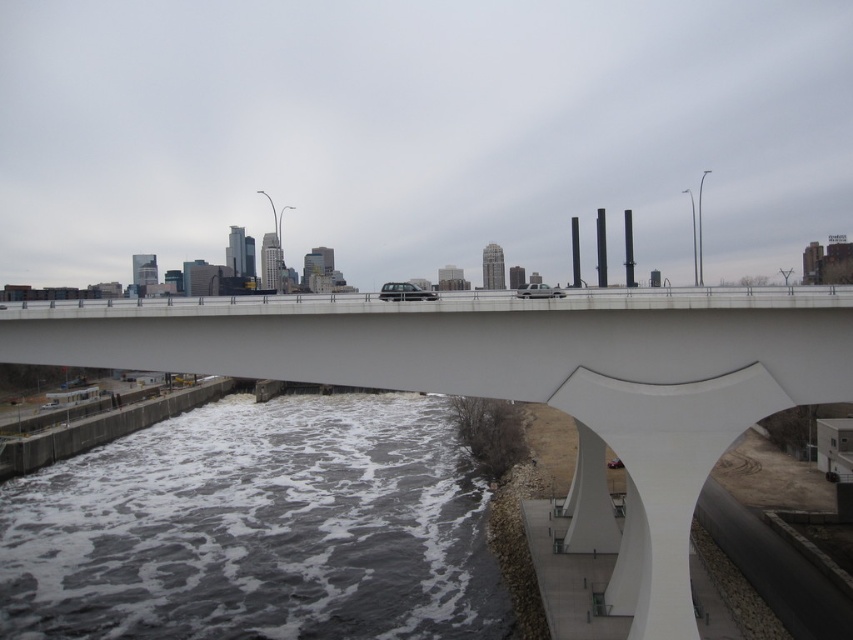
You are a photographer standing on the riverbank and want to capture both the white frothy water at lower center and the white smooth bridge at center in a single photo. Which object will appear closer to you in the photo?

The white frothy water at lower center will appear closer to you in the photo because it is further to the viewer than the white smooth bridge at center, making it appear nearer in the image.

You are a drone operator tasked with capturing aerial footage of the white smooth bridge at center. Your drone has a maximum flight altitude of 25 meters. If you position the drone directly above the white frothy water at lower center, will the drone be able to fly under the bridge without exceeding its altitude limit?

The distance between the white frothy water at lower center and the white smooth bridge at center is 24.53 meters. Since the drone can fly up to 25 meters, it will be able to safely fly under the bridge without exceeding its altitude limit.

You are a city planner analyzing the image to assess the bridge and river conditions. Given the white frothy water at lower center and the white smooth bridge at center, which one has a greater width in the image?

The white frothy water at lower center has a greater width than the white smooth bridge at center according to the description.